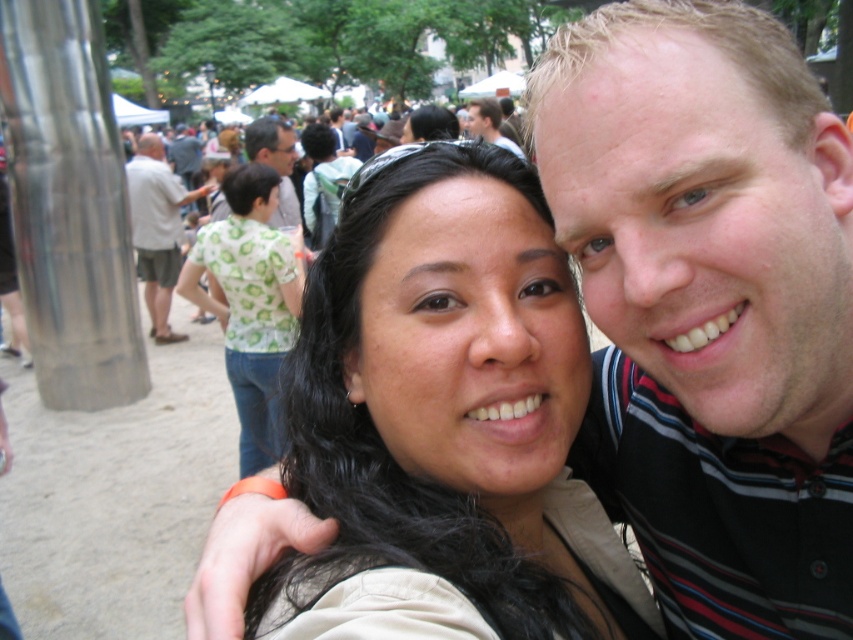
You are standing at point (212, 276) in the scene and want to take a photo of the two people in the foreground. The camera you have can focus on subjects within 20 feet. Will the camera be able to focus on the two people in the foreground?

The distance between point (212, 276) and the camera is 18.45 feet, which is within the camera focus range of 20 feet. Therefore, the camera can focus on the two people in the foreground.

You are a photographer at the event and want to capture a photo that includes both the matte khaki shirt at center and the dark brown leather jacket at upper center. Based on their positions, which one should you focus on first to ensure both are in frame?

The matte khaki shirt at center is to the left of the dark brown leather jacket at upper center, so you should focus on the matte khaki shirt at center first to ensure both are in frame.